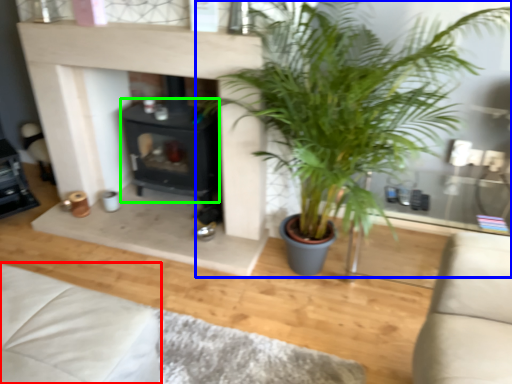
Question: Which object is the closest to the couch (highlighted by a red box)? Choose among these: houseplant (highlighted by a blue box) or fireplace (highlighted by a green box).

Choices:
 (A) houseplant
 (B) fireplace

Answer: (A)